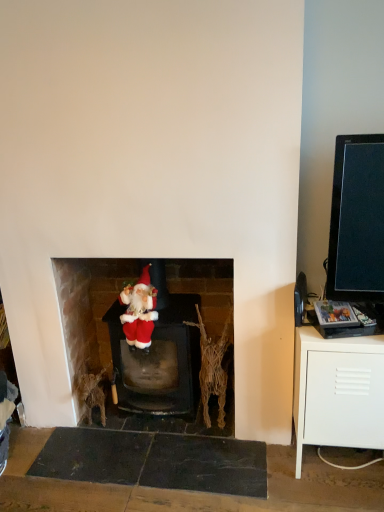
Question: Is velvet santa at center in contact with white matte cabinet at right?

Choices:
 (A) yes
 (B) no

Answer: (B)

Question: Is velvet santa at center positioned with its back to white matte cabinet at right?

Choices:
 (A) yes
 (B) no

Answer: (B)

Question: Can you confirm if velvet santa at center is shorter than white matte cabinet at right?

Choices:
 (A) no
 (B) yes

Answer: (A)

Question: From the image's perspective, does velvet santa at center appear higher than white matte cabinet at right?

Choices:
 (A) yes
 (B) no

Answer: (A)

Question: Is velvet santa at center completely or partially outside of white matte cabinet at right?

Choices:
 (A) no
 (B) yes

Answer: (B)

Question: From a real-world perspective, relative to white matte cabinet at right, is fuzzy fabric santa at center vertically above or below?

Choices:
 (A) above
 (B) below

Answer: (A)

Question: Is fuzzy fabric santa at center taller or shorter than white matte cabinet at right?

Choices:
 (A) tall
 (B) short

Answer: (B)

Question: Is point (135, 302) closer or farther from the camera than point (357, 346)?

Choices:
 (A) farther
 (B) closer

Answer: (A)

Question: Choose the correct answer: Is fuzzy fabric santa at center inside white matte cabinet at right or outside it?

Choices:
 (A) outside
 (B) inside

Answer: (A)

Question: Looking at the image, does velvet santa at center seem bigger or smaller compared to white matte cabinet at right?

Choices:
 (A) small
 (B) big

Answer: (A)

Question: In terms of height, does velvet santa at center look taller or shorter compared to white matte cabinet at right?

Choices:
 (A) short
 (B) tall

Answer: (B)

Question: Does point (119, 381) appear closer or farther from the camera than point (364, 415)?

Choices:
 (A) farther
 (B) closer

Answer: (A)

Question: Considering the positions of velvet santa at center and white matte cabinet at right in the image, is velvet santa at center wider or thinner than white matte cabinet at right?

Choices:
 (A) wide
 (B) thin

Answer: (B)

Question: Which is correct: white matte cabinet at right is inside fuzzy fabric santa at center, or outside of it?

Choices:
 (A) outside
 (B) inside

Answer: (A)

Question: Considering the positions of white matte cabinet at right and fuzzy fabric santa at center in the image, is white matte cabinet at right taller or shorter than fuzzy fabric santa at center?

Choices:
 (A) short
 (B) tall

Answer: (B)